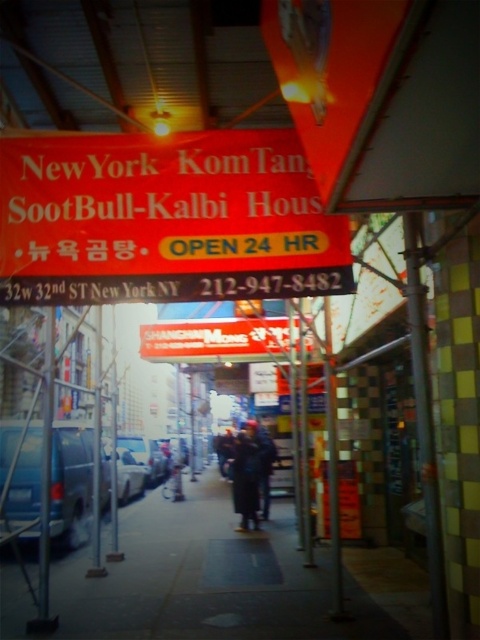
You are a delivery driver who needs to park your blue matte van at center near the red plastic sign at center. Based on the scene, can you safely park the van so it doesn not block the sign?

The red plastic sign at center is to the right of the blue matte van at center, so parking the van would not block the sign as they are positioned side by side horizontally.

You are a delivery driver who needs to park your blue matte van at center in a spot that allows you to see the red plastic sign at center clearly. Is the current position of the van blocking your view of the sign?

The red plastic sign at center is positioned over the blue matte van at center, meaning the van is parked directly beneath it. Since the sign is above the van, the driver should have an unobstructed view of the sign from their current position.

You are a delivery driver who needs to read both the red plastic sign at center and the white matte sign at center to confirm the restaurant details. Since you can only focus on one sign at a time, which one should you look at first to see the phone number?

The red plastic sign at center is positioned on the right side of white matte sign at center. Since the phone number is typically listed after the business name, you should look at the red plastic sign at center first to read the phone number.